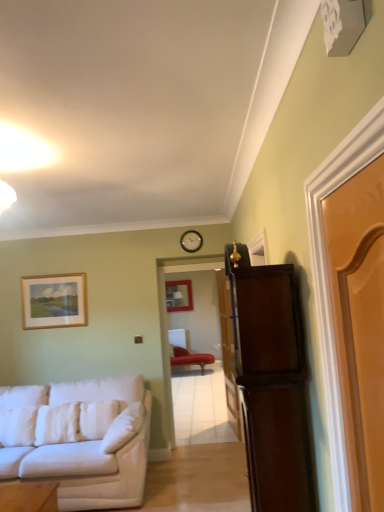
Question: From a real-world perspective, does wooden picture frame at upper left, which appears as the 1th picture frame when viewed from the front, stand above wooden door at center, which is the 1th door from back to front?

Choices:
 (A) yes
 (B) no

Answer: (A)

Question: Is wooden picture frame at upper left, which appears as the 1th picture frame when viewed from the front, facing away from wooden door at center, which is the 1th door from back to front?

Choices:
 (A) yes
 (B) no

Answer: (B)

Question: Is wooden door at center, placed as the 3th door when sorted from front to back, inside wooden picture frame at upper left, which is the 2th picture frame from back to front?

Choices:
 (A) no
 (B) yes

Answer: (A)

Question: From the image's perspective, does wooden picture frame at upper left, placed as the 2th picture frame when sorted from right to left, appear higher than wooden door at center, which is the 1th door from back to front?

Choices:
 (A) yes
 (B) no

Answer: (A)

Question: Is wooden picture frame at upper left, placed as the 2th picture frame when sorted from right to left, aimed at wooden door at center, which is the 1th door from back to front?

Choices:
 (A) no
 (B) yes

Answer: (A)

Question: Is wooden picture frame at upper left, placed as the 2th picture frame when sorted from right to left, not within wooden door at center, which is the 1th door from back to front?

Choices:
 (A) yes
 (B) no

Answer: (A)

Question: Considering the relative sizes of matte wooden picture frame at center, which is the second picture frame in left-to-right order, and white soft pillow at lower left, the second pillow when ordered from right to left, in the image provided, is matte wooden picture frame at center, which is the second picture frame in left-to-right order, shorter than white soft pillow at lower left, the second pillow when ordered from right to left,?

Choices:
 (A) yes
 (B) no

Answer: (B)

Question: Is matte wooden picture frame at center, which is the second picture frame in left-to-right order, positioned behind white soft pillow at lower left, the second pillow when ordered from right to left?

Choices:
 (A) yes
 (B) no

Answer: (A)

Question: Is matte wooden picture frame at center, the first picture frame when ordered from right to left, far away from white soft pillow at lower left, the second pillow when ordered from right to left?

Choices:
 (A) yes
 (B) no

Answer: (A)

Question: Is matte wooden picture frame at center, which is the second picture frame in left-to-right order, positioned before white soft pillow at lower left, the second pillow when ordered from right to left?

Choices:
 (A) no
 (B) yes

Answer: (A)

Question: From a real-world perspective, is matte wooden picture frame at center, arranged as the second picture frame when viewed from the front, below white soft pillow at lower left, the second pillow when ordered from right to left?

Choices:
 (A) yes
 (B) no

Answer: (B)

Question: Is matte wooden picture frame at center, the first picture frame when ordered from right to left, oriented away from white soft pillow at lower left, positioned as the second pillow in left-to-right order?

Choices:
 (A) yes
 (B) no

Answer: (B)

Question: From a real-world perspective, does light brown wooden door at right, which is counted as the first door, starting from the front, sit lower than white fabric couch at left?

Choices:
 (A) no
 (B) yes

Answer: (A)